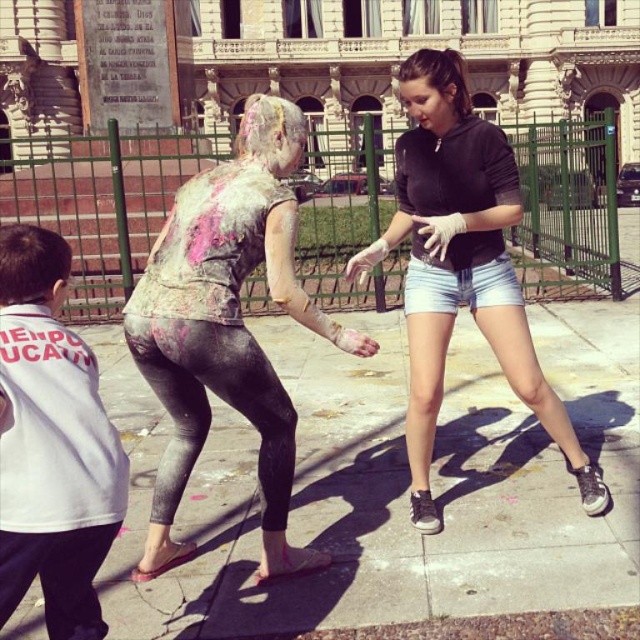
Question: Observing the image, what is the correct spatial positioning of concrete sidewalk at center in reference to white cotton shirt at left?

Choices:
 (A) left
 (B) right

Answer: (B)

Question: Does matte black hoodie at center appear over white cotton shirt at left?

Choices:
 (A) yes
 (B) no

Answer: (A)

Question: Observing the image, what is the correct spatial positioning of concrete sidewalk at center in reference to painted fabric leggings at center?

Choices:
 (A) right
 (B) left

Answer: (A)

Question: Which of the following is the closest to the observer?

Choices:
 (A) click(x=358, y=257)
 (B) click(x=273, y=460)
 (C) click(x=26, y=584)
 (D) click(x=204, y=577)

Answer: (C)

Question: Which object is farther from the camera taking this photo?

Choices:
 (A) matte black hoodie at center
 (B) concrete sidewalk at center
 (C) white cotton shirt at left

Answer: (A)

Question: Among these objects, which one is farthest from the camera?

Choices:
 (A) painted fabric leggings at center
 (B) matte black hoodie at center

Answer: (B)